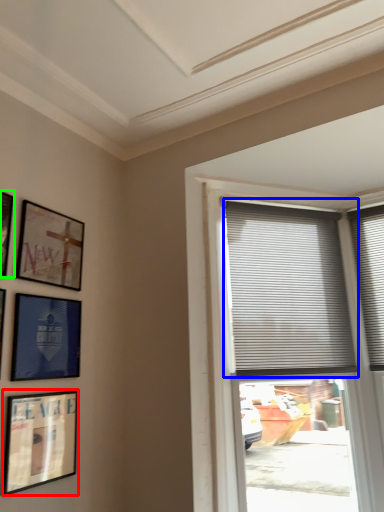
Question: Based on their relative distances, which object is farther from picture frame (highlighted by a red box)? Choose from window blind (highlighted by a blue box) and picture frame (highlighted by a green box).

Choices:
 (A) window blind
 (B) picture frame

Answer: (A)